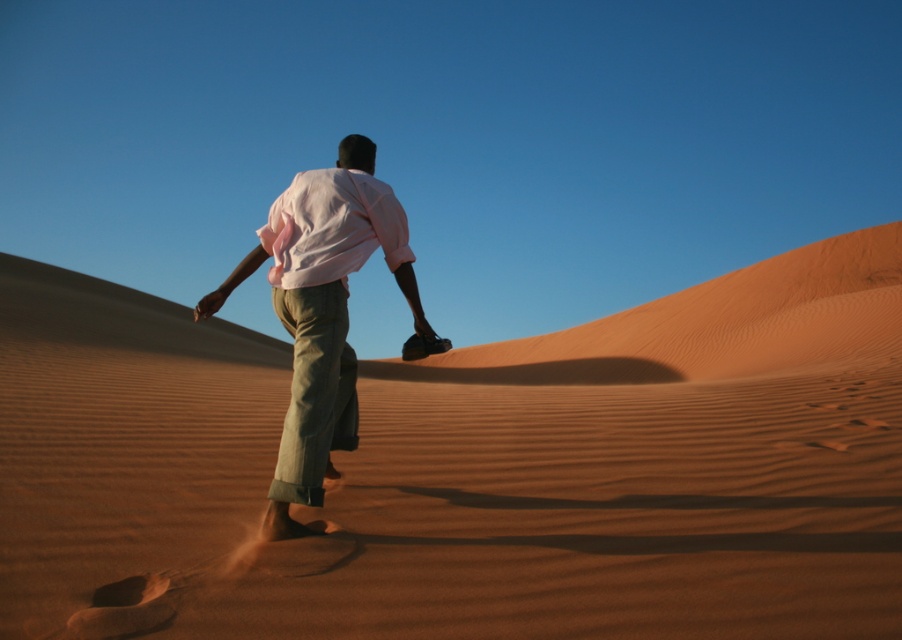
Between point (226, 560) and point (342, 308), which one is positioned in front?

Positioned in front is point (226, 560).

Is smooth sand at center thinner than pink cotton shirt at center?

In fact, smooth sand at center might be wider than pink cotton shirt at center.

Does point (339, 577) come in front of point (320, 400)?

Yes, it is in front of point (320, 400).

The height and width of the screenshot is (640, 902). I want to click on smooth sand at center, so click(474, 465).